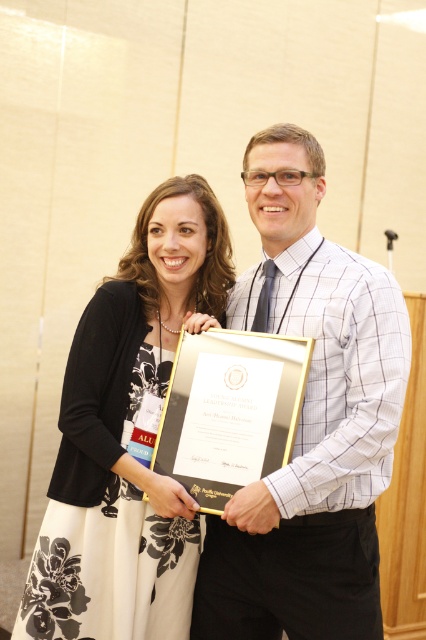
Question: Which object is positioned closest to the white checkered shirt at center?

Choices:
 (A) black floral dress at center
 (B) gold metallic plaque at center

Answer: (B)

Question: Does white checkered shirt at center appear on the left side of black floral dress at center?

Choices:
 (A) yes
 (B) no

Answer: (B)

Question: Is black floral dress at center smaller than gold metallic plaque at center?

Choices:
 (A) no
 (B) yes

Answer: (A)

Question: Which of the following is the farthest from the observer?

Choices:
 (A) (333, 360)
 (B) (100, 522)
 (C) (169, 412)

Answer: (C)

Question: Is white checkered shirt at center closer to the viewer compared to black floral dress at center?

Choices:
 (A) no
 (B) yes

Answer: (B)

Question: Which object is farther from the camera taking this photo?

Choices:
 (A) white checkered shirt at center
 (B) black floral dress at center
 (C) gold metallic plaque at center

Answer: (B)